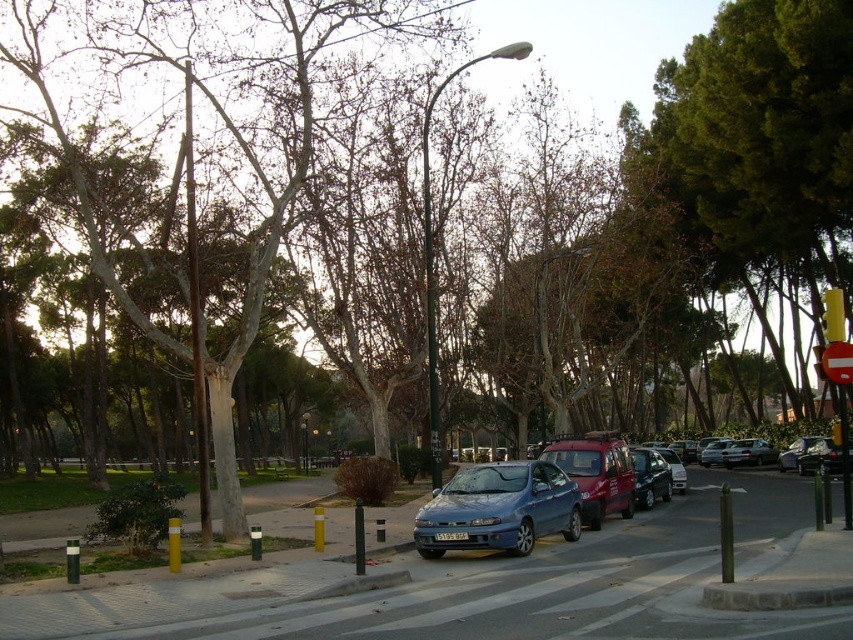
Does satin blue sedan at center have a lesser height compared to satin silver sedan at center-right?

Incorrect, satin blue sedan at center's height does not fall short of satin silver sedan at center-right's.

Is point (567, 484) positioned in front of point (772, 449)?

Yes, it is in front of point (772, 449).

Identify the location of satin blue sedan at center. The width and height of the screenshot is (853, 640). (498, 509).

Looking at this image, can you confirm if metallic blue sedan at center is smaller than satin blue sedan at center?

Incorrect, metallic blue sedan at center is not smaller in size than satin blue sedan at center.

Which is more to the left, metallic blue sedan at center or satin blue sedan at center?

satin blue sedan at center is more to the left.

The height and width of the screenshot is (640, 853). What are the coordinates of `metallic blue sedan at center` in the screenshot? It's located at (541, 496).

Is green leafy tree at upper right smaller than satin silver sedan at center-right?

Incorrect, green leafy tree at upper right is not smaller in size than satin silver sedan at center-right.

Can you confirm if green leafy tree at upper right is shorter than satin silver sedan at center-right?

No, green leafy tree at upper right is not shorter than satin silver sedan at center-right.

Locate an element on the screen. This screenshot has width=853, height=640. green leafy tree at upper right is located at coordinates (761, 145).